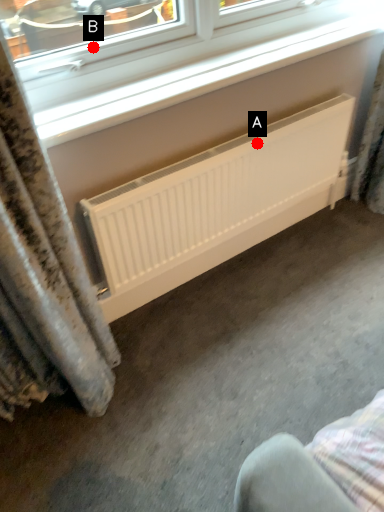
Question: Two points are circled on the image, labeled by A and B beside each circle. Which of the following is the farthest from the observer?

Choices:
 (A) A is further
 (B) B is further

Answer: (A)